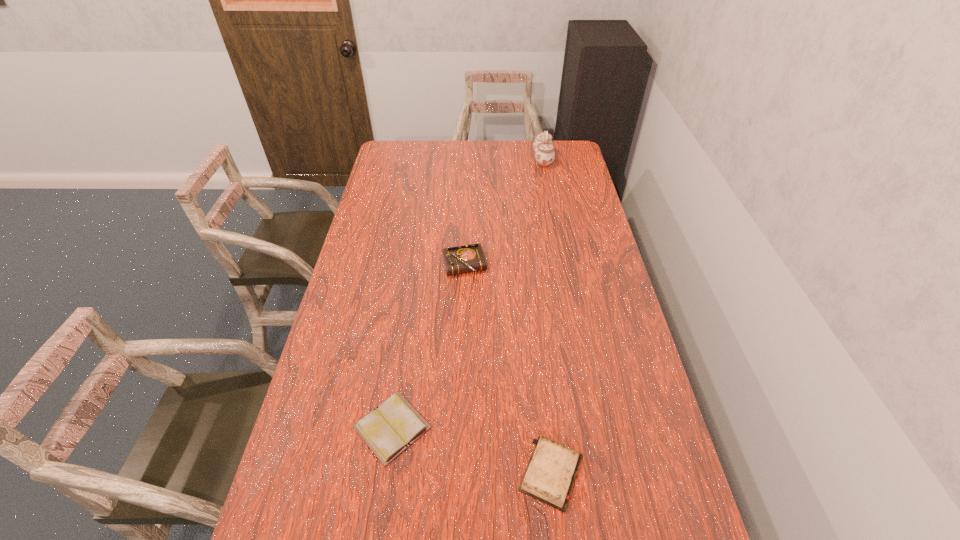
The image size is (960, 540). What are the coordinates of `free spot at the far left corner of the desktop` in the screenshot? It's located at (391, 151).

In the image, there is a desktop. Where is `vacant space at the far right corner`? This screenshot has height=540, width=960. vacant space at the far right corner is located at coordinates (572, 163).

Locate an element on the screen. free space between the tallest object and the shortest object is located at coordinates (468, 293).

Locate an element on the screen. The width and height of the screenshot is (960, 540). vacant space that's between the shortest diary and the third nearest object is located at coordinates (428, 347).

This screenshot has height=540, width=960. I want to click on free space between the chinaware and the shortest object, so click(x=468, y=293).

The height and width of the screenshot is (540, 960). I want to click on free space between the farthest object and the shortest diary, so click(x=468, y=293).

At what (x,y) coordinates should I click in order to perform the action: click on unoccupied area between the shortest diary and the farthest diary. Please return your answer as a coordinate pair (x, y). This screenshot has height=540, width=960. Looking at the image, I should click on (428, 347).

Where is `free space between the third nearest object and the shortest object`? Image resolution: width=960 pixels, height=540 pixels. free space between the third nearest object and the shortest object is located at coordinates (428, 347).

You are a GUI agent. You are given a task and a screenshot of the screen. Output one action in this format:
    pyautogui.click(x=<x>, y=<y>)
    Task: Click on the free space that is in between the tallest diary and the second tallest diary
    
    Given the screenshot: What is the action you would take?
    pyautogui.click(x=508, y=369)

This screenshot has width=960, height=540. I want to click on vacant space in between the second farthest object and the second shortest object, so click(x=508, y=369).